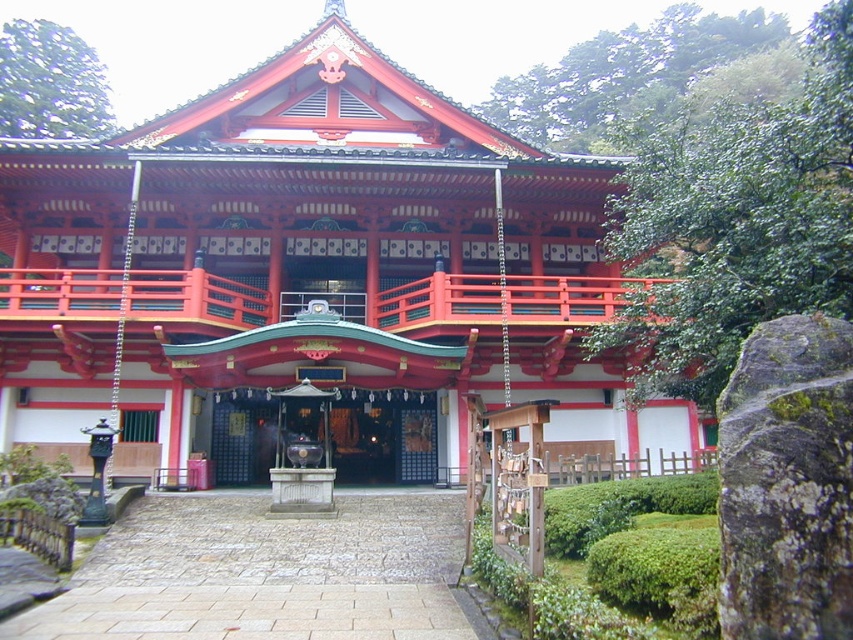
Question: Is shiny red wood temple at center smaller than smooth stone altar at center?

Choices:
 (A) no
 (B) yes

Answer: (A)

Question: Which object is farther from the camera taking this photo?

Choices:
 (A) smooth stone altar at center
 (B) shiny red wood temple at center

Answer: (A)

Question: Can you confirm if shiny red wood temple at center is positioned to the right of smooth stone altar at center?

Choices:
 (A) no
 (B) yes

Answer: (A)

Question: Can you confirm if shiny red wood temple at center is smaller than smooth stone altar at center?

Choices:
 (A) yes
 (B) no

Answer: (B)